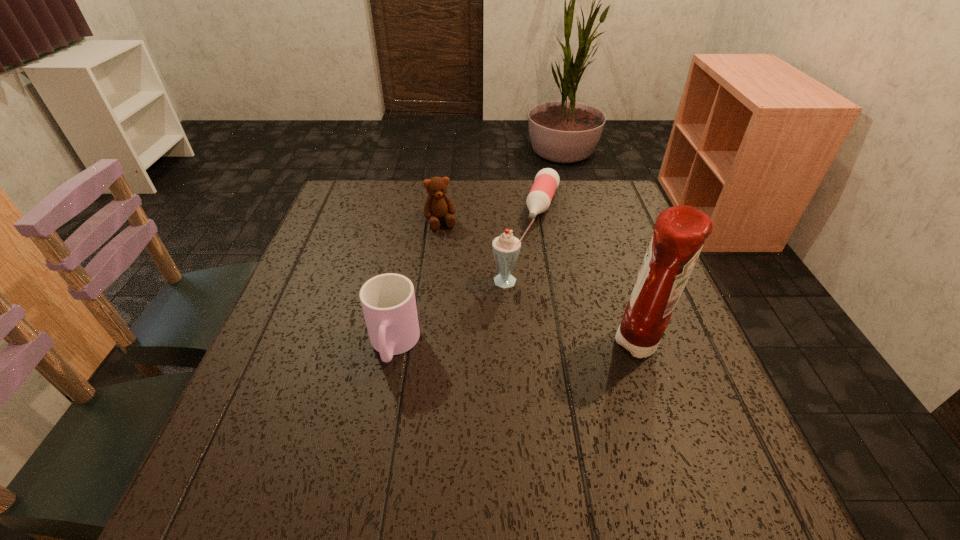
The height and width of the screenshot is (540, 960). I want to click on teddy bear situated at the far edge, so click(x=438, y=205).

Where is `object present at the right edge`? The width and height of the screenshot is (960, 540). object present at the right edge is located at coordinates (679, 233).

This screenshot has height=540, width=960. In the image, there is a desktop. Find the location of `vacant space at the far edge`. vacant space at the far edge is located at coordinates (498, 194).

At what (x,y) coordinates should I click in order to perform the action: click on vacant space at the left edge. Please return your answer as a coordinate pair (x, y). The image size is (960, 540). Looking at the image, I should click on (376, 227).

This screenshot has height=540, width=960. In the image, there is a desktop. What are the coordinates of `vacant space at the right edge` in the screenshot? It's located at (626, 254).

At what (x,y) coordinates should I click in order to perform the action: click on free space at the far right corner of the desktop. Please return your answer as a coordinate pair (x, y). Image resolution: width=960 pixels, height=540 pixels. Looking at the image, I should click on (612, 222).

The width and height of the screenshot is (960, 540). Find the location of `empty space between the tallest object and the milkshake`. empty space between the tallest object and the milkshake is located at coordinates (575, 313).

This screenshot has height=540, width=960. Identify the location of free spot between the teddy bear and the third nearest object. (475, 251).

This screenshot has height=540, width=960. Identify the location of unoccupied area between the tallest object and the shortest object. (591, 275).

You are a GUI agent. You are given a task and a screenshot of the screen. Output one action in this format:
    pyautogui.click(x=<x>, y=<y>)
    Task: Click on the vacant region between the rightmost object and the cup
    
    Given the screenshot: What is the action you would take?
    pyautogui.click(x=517, y=346)